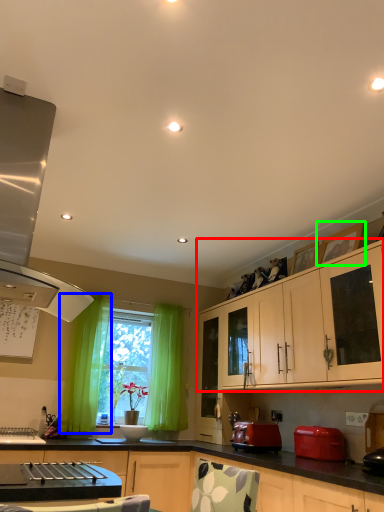
Question: Which is farther away from cabinetry (highlighted by a red box)? curtain (highlighted by a blue box) or picture frame (highlighted by a green box)?

Choices:
 (A) curtain
 (B) picture frame

Answer: (A)